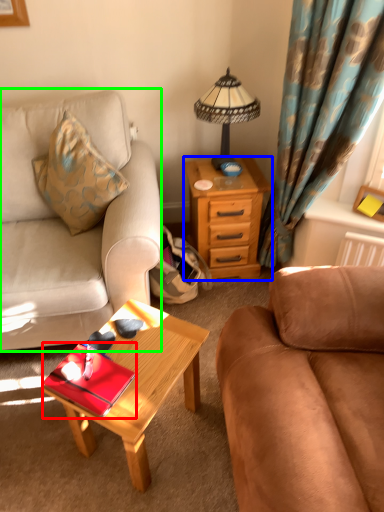
Question: Which object is positioned closest to tray (highlighted by a red box)? Select from desk (highlighted by a blue box) and studio couch (highlighted by a green box).

Choices:
 (A) desk
 (B) studio couch

Answer: (B)